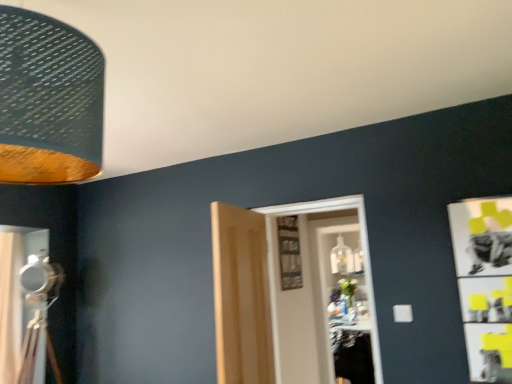
Question: From the image's perspective, would you say textured fabric lampshade at upper left is positioned over matte silver curtain at left?

Choices:
 (A) no
 (B) yes

Answer: (B)

Question: Could you tell me if textured fabric lampshade at upper left is facing matte silver curtain at left?

Choices:
 (A) yes
 (B) no

Answer: (B)

Question: From a real-world perspective, is textured fabric lampshade at upper left below matte silver curtain at left?

Choices:
 (A) no
 (B) yes

Answer: (A)

Question: Is textured fabric lampshade at upper left located outside matte silver curtain at left?

Choices:
 (A) no
 (B) yes

Answer: (B)

Question: Can you see textured fabric lampshade at upper left touching matte silver curtain at left?

Choices:
 (A) yes
 (B) no

Answer: (B)

Question: Is textured fabric lampshade at upper left bigger than matte silver curtain at left?

Choices:
 (A) yes
 (B) no

Answer: (B)

Question: From a real-world perspective, is textured fabric lampshade at upper left located higher than white wooden door at center, arranged as the 2th door when viewed from the left?

Choices:
 (A) no
 (B) yes

Answer: (B)

Question: Is white wooden door at center, arranged as the 2th door when viewed from the left, at the back of textured fabric lampshade at upper left?

Choices:
 (A) yes
 (B) no

Answer: (B)

Question: Considering the relative positions of textured fabric lampshade at upper left and white wooden door at center, arranged as the 2th door when viewed from the left, in the image provided, is textured fabric lampshade at upper left behind white wooden door at center, arranged as the 2th door when viewed from the left,?

Choices:
 (A) yes
 (B) no

Answer: (B)

Question: Does textured fabric lampshade at upper left come in front of white wooden door at center, which is the 1th door in right-to-left order?

Choices:
 (A) yes
 (B) no

Answer: (A)

Question: From the image's perspective, is textured fabric lampshade at upper left over white wooden door at center, which is the 1th door in right-to-left order?

Choices:
 (A) yes
 (B) no

Answer: (A)

Question: Is textured fabric lampshade at upper left far from white wooden door at center, arranged as the 2th door when viewed from the left?

Choices:
 (A) yes
 (B) no

Answer: (A)

Question: Are light wood paneling at center, the second door from the right, and white wooden door at center, which is the 1th door in right-to-left order, beside each other?

Choices:
 (A) no
 (B) yes

Answer: (A)